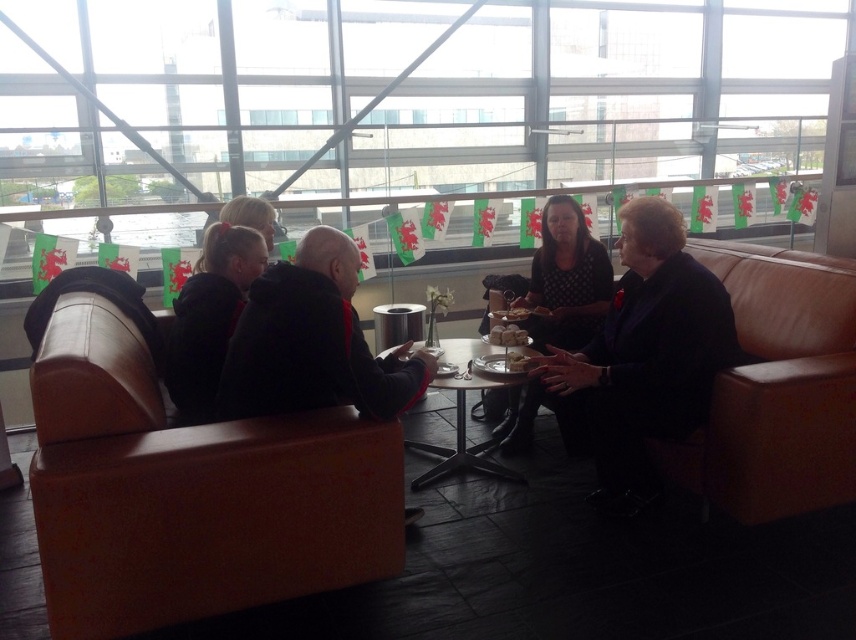
Question: Which of these objects is positioned closest to the blonde hair at center?

Choices:
 (A) dark brown leather jacket at center
 (B) black leather jacket at center
 (C) polka dot dress at center

Answer: (B)

Question: Can you confirm if dark brown leather jacket at center is positioned below blonde hair at center?

Choices:
 (A) yes
 (B) no

Answer: (A)

Question: Which point appears farthest from the camera in this image?

Choices:
 (A) (223, 353)
 (B) (265, 202)
 (C) (330, 10)
 (D) (735, 356)

Answer: (C)

Question: Among these points, which one is nearest to the camera?

Choices:
 (A) (626, 314)
 (B) (204, 410)

Answer: (B)

Question: Can you confirm if brown leather couch at left is wider than black leather jacket at center?

Choices:
 (A) no
 (B) yes

Answer: (B)

Question: Does dark brown leather jacket at center lie in front of dark gray hoodie at left?

Choices:
 (A) yes
 (B) no

Answer: (A)